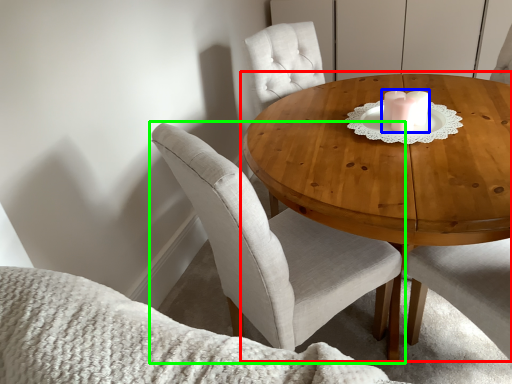
Question: Which object is the farthest from coffee table (highlighted by a red box)? Choose among these: candle holder (highlighted by a blue box) or chair (highlighted by a green box).

Choices:
 (A) candle holder
 (B) chair

Answer: (B)